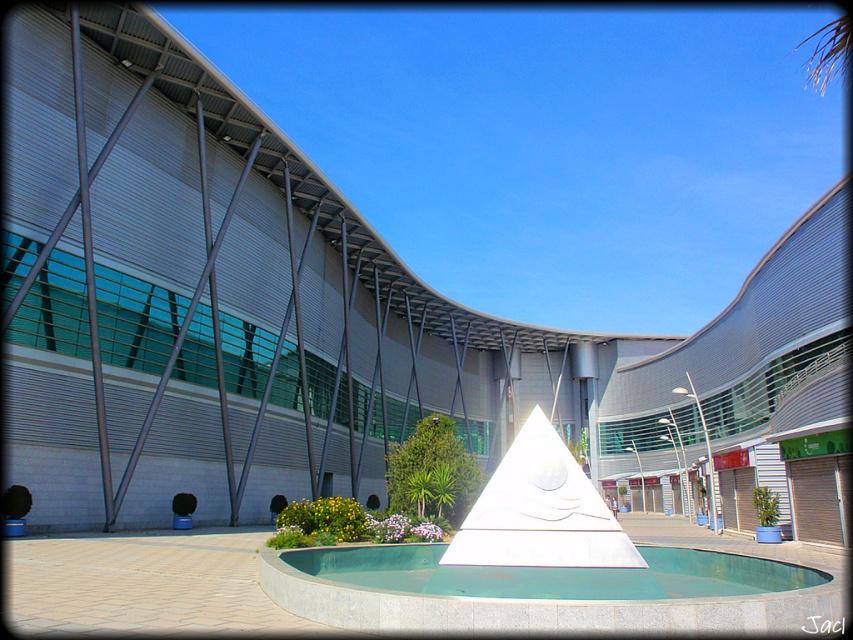
You are a visitor standing in front of the modern architectural structure. You notice the white marble fountain at center and the green polished stone pool at center. Which object is positioned higher in elevation?

The white marble fountain at center is above the green polished stone pool at center, so it is positioned higher in elevation.

You are an architect designing a new sculpture garden. You have two objects to place in the garden layout. The white marble fountain at center and the green polished stone pool at center. Based on their sizes, which one should you place first to ensure proper spacing?

The white marble fountain at center is larger in size than the green polished stone pool at center, so you should place the white marble fountain at center first to ensure proper spacing.